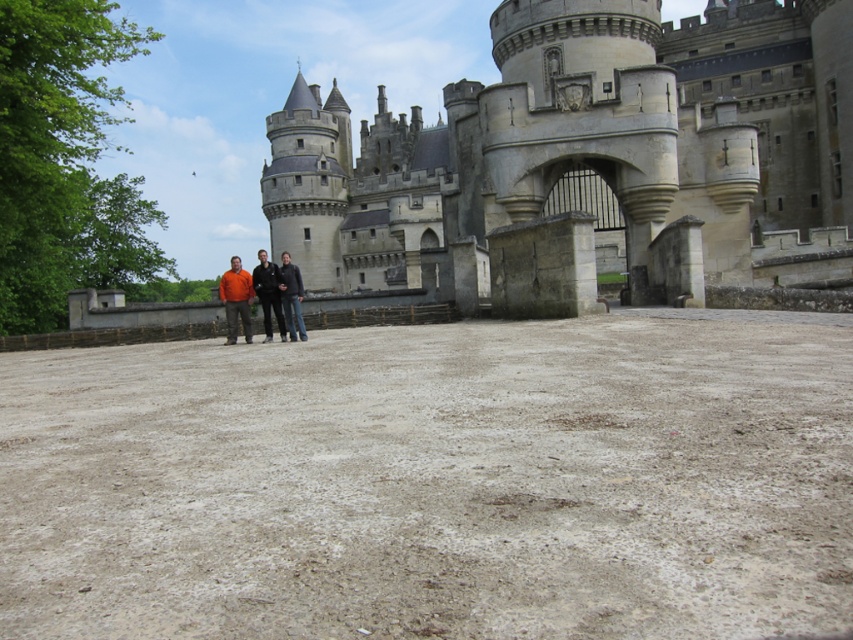
Consider the image. Can you confirm if orange fabric jacket at center is wider than dark blue jeans at center?

No.

Who is more distant from viewer, (x=244, y=282) or (x=299, y=292)?

Positioned behind is point (x=244, y=282).

Where is `orange fabric jacket at center`? The height and width of the screenshot is (640, 853). orange fabric jacket at center is located at coordinates (252, 296).

Is gray stone castle at center positioned behind orange fabric jacket at center?

No, it is not.

Can you confirm if gray stone castle at center is shorter than orange fabric jacket at center?

No, gray stone castle at center is not shorter than orange fabric jacket at center.

Which is behind, point (764, 134) or point (230, 333)?

The point (764, 134) is more distant.

The width and height of the screenshot is (853, 640). I want to click on gray stone castle at center, so click(x=587, y=147).

Is orange fabric jacket at center bigger than orange matte shirt at center?

Correct, orange fabric jacket at center is larger in size than orange matte shirt at center.

Which is above, orange fabric jacket at center or orange matte shirt at center?

orange fabric jacket at center

Where is `orange fabric jacket at center`? The image size is (853, 640). orange fabric jacket at center is located at coordinates (x=252, y=296).